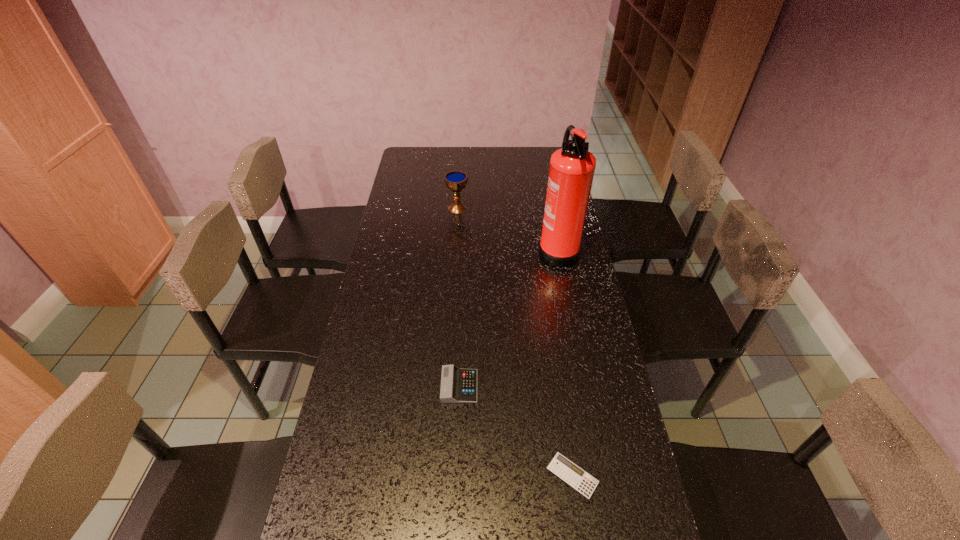
At what (x,y) coordinates should I click in order to perform the action: click on the tallest object. Please return your answer as a coordinate pair (x, y). The height and width of the screenshot is (540, 960). Looking at the image, I should click on (572, 167).

At what (x,y) coordinates should I click in order to perform the action: click on the second farthest object. Please return your answer as a coordinate pair (x, y). Image resolution: width=960 pixels, height=540 pixels. Looking at the image, I should click on (572, 167).

What are the coordinates of `chalice` in the screenshot? It's located at (456, 181).

This screenshot has height=540, width=960. I want to click on the third shortest object, so click(456, 181).

Locate an element on the screen. The height and width of the screenshot is (540, 960). the taller calculator is located at coordinates (458, 385).

Find the location of `the farther calculator`. the farther calculator is located at coordinates (458, 385).

Locate an element on the screen. This screenshot has height=540, width=960. the nearer calculator is located at coordinates (561, 466).

At what (x,y) coordinates should I click in order to perform the action: click on the right calculator. Please return your answer as a coordinate pair (x, y). The image size is (960, 540). Looking at the image, I should click on (561, 466).

Locate an element on the screen. free space located at the nozzle of the third nearest object is located at coordinates (516, 248).

Where is `free space located 0.140m at the nozzle of the third nearest object`? free space located 0.140m at the nozzle of the third nearest object is located at coordinates (500, 248).